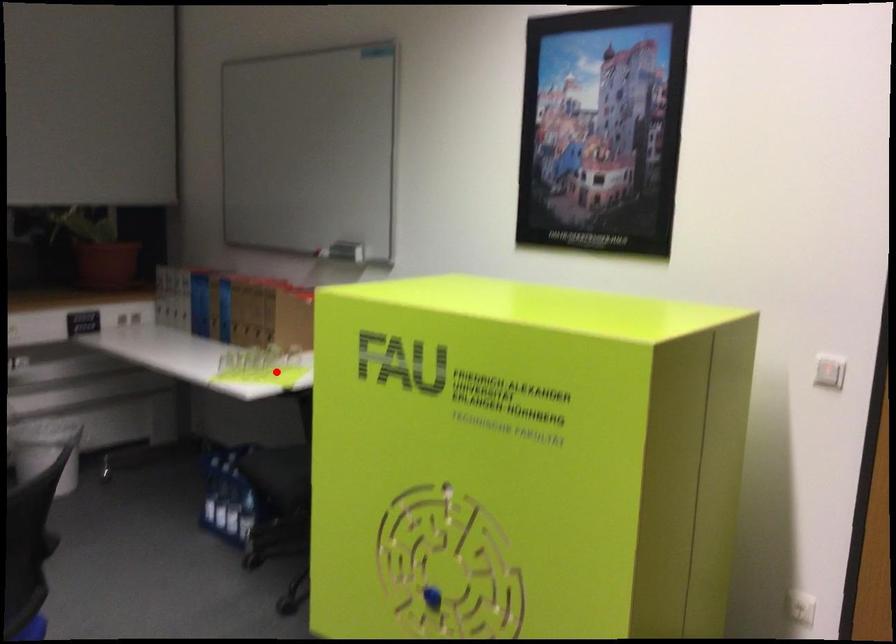
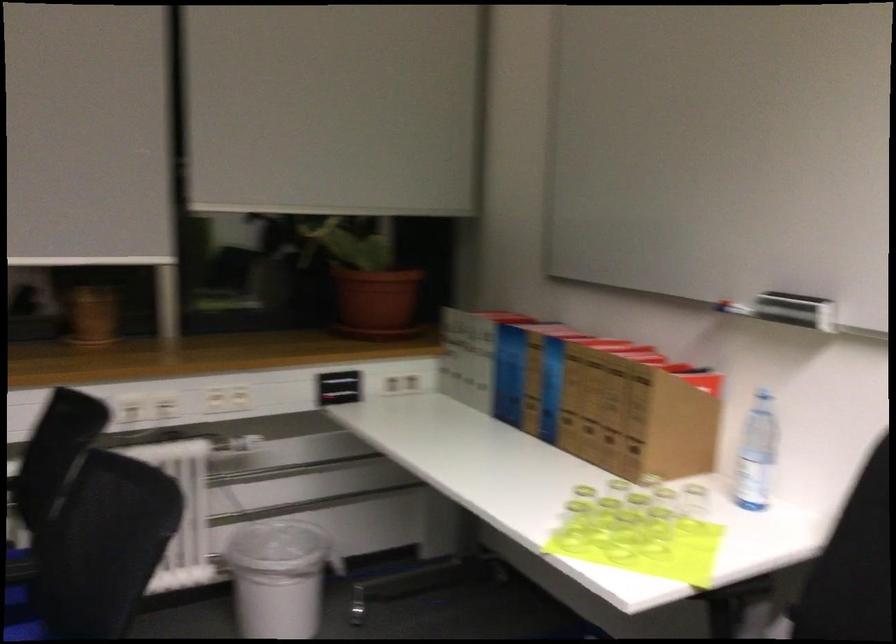
Where in the second image is the point corresponding to the highlighted location from the first image?

(655, 534)